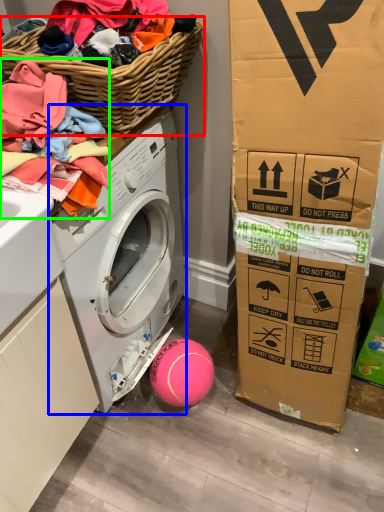
Question: Based on their relative distances, which object is farther from basket (highlighted by a red box)? Choose from washing machine (highlighted by a blue box) and clothing (highlighted by a green box).

Choices:
 (A) washing machine
 (B) clothing

Answer: (A)